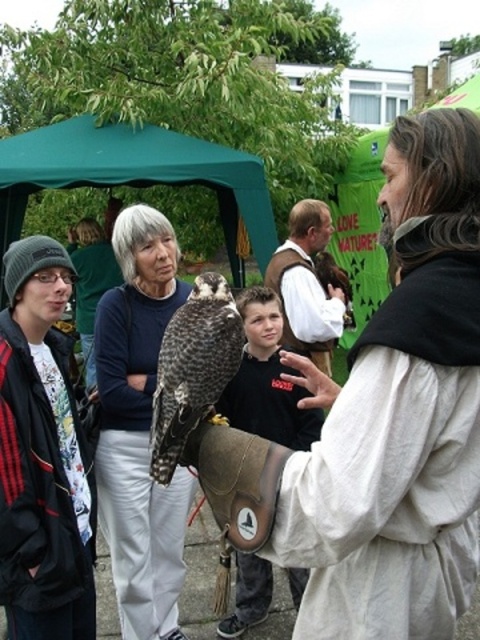
Who is taller, white cotton robe at center or brown leather glove at center?

white cotton robe at center

Is white cotton robe at center thinner than brown leather glove at center?

No.

Locate an element on the screen. This screenshot has height=640, width=480. white cotton robe at center is located at coordinates (395, 464).

Is matte black jacket at center taller than brushed metal jacket at left?

Correct, matte black jacket at center is much taller as brushed metal jacket at left.

Who is positioned more to the right, matte black jacket at center or brushed metal jacket at left?

matte black jacket at center is more to the right.

Measure the distance between matte black jacket at center and camera.

matte black jacket at center and camera are 5.40 meters apart.

You are a GUI agent. You are given a task and a screenshot of the screen. Output one action in this format:
    pyautogui.click(x=<x>, y=<y>)
    Task: Click on the matte black jacket at center
    
    Given the screenshot: What is the action you would take?
    pyautogui.click(x=139, y=428)

Is point (123, 602) more distant than point (111, 140)?

No, it is not.

Between matte black jacket at center and green fabric canopy at upper left, which one has more height?

matte black jacket at center is taller.

Find the location of a particular element. matte black jacket at center is located at coordinates (139, 428).